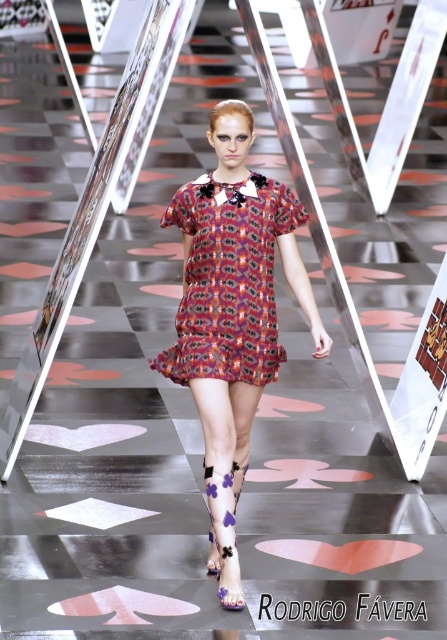
Question: Does printed fabric dress at center lie in front of printed silk dress at center?

Choices:
 (A) no
 (B) yes

Answer: (B)

Question: Considering the relative positions of printed fabric dress at center and printed silk dress at center in the image provided, where is printed fabric dress at center located with respect to printed silk dress at center?

Choices:
 (A) below
 (B) above

Answer: (A)

Question: Observing the image, what is the correct spatial positioning of printed fabric dress at center in reference to printed silk dress at center?

Choices:
 (A) above
 (B) below

Answer: (B)

Question: Among these points, which one is farthest from the camera?

Choices:
 (A) (261, 314)
 (B) (172, 364)

Answer: (B)